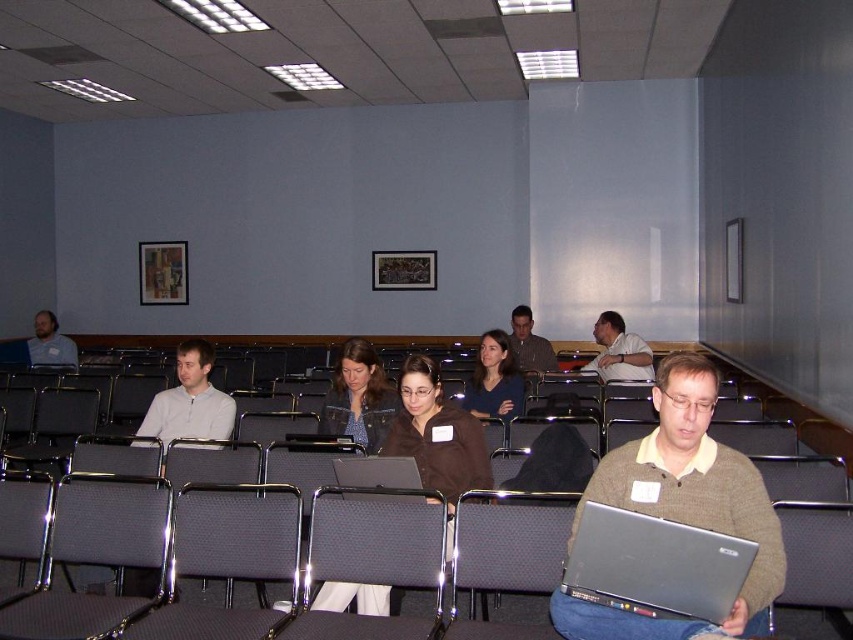
Question: Which object is the farthest from the matte brown sweater at center?

Choices:
 (A) silver metallic laptop at center
 (B) matte gray shirt at center
 (C) brown leather jacket at center
 (D) gray fabric chair at center

Answer: (B)

Question: Does silver metallic laptop at lower right have a greater width compared to dark brown sweater at center?

Choices:
 (A) no
 (B) yes

Answer: (B)

Question: Is dark brown sweater at center to the right of matte gray shirt at center from the viewer's perspective?

Choices:
 (A) no
 (B) yes

Answer: (B)

Question: Which point is farther to the camera?

Choices:
 (A) knit sweater at right
 (B) dark brown sweater at center
 (C) gray fabric chair at center
 (D) silver metallic laptop at lower right

Answer: (B)

Question: Can you confirm if dark brown sweater at center is positioned to the right of matte brown sweater at center?

Choices:
 (A) no
 (B) yes

Answer: (A)

Question: Which point is farther to the camera?

Choices:
 (A) dark brown sweater at center
 (B) silver metallic laptop at center

Answer: (A)